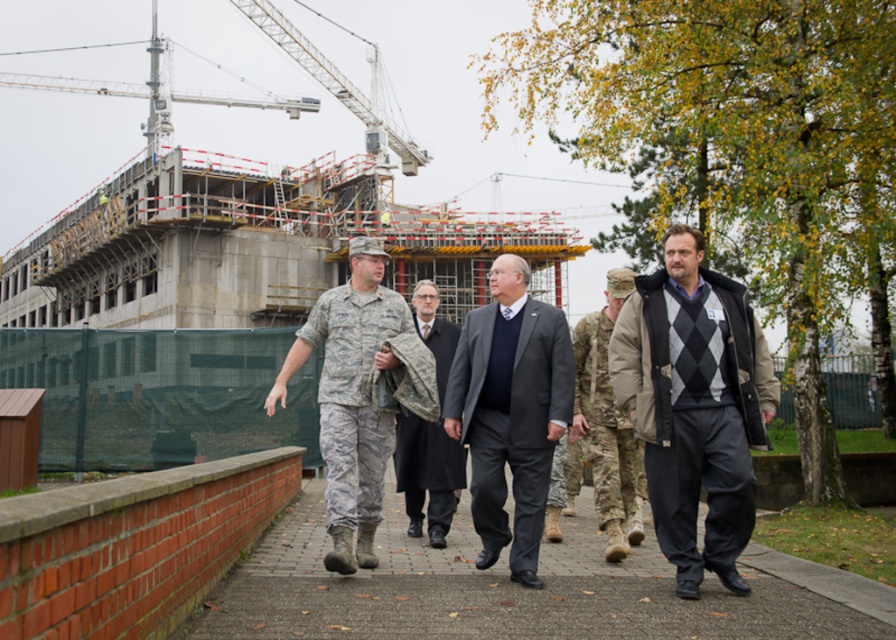
Question: Which object is positioned closest to the dark gray wool suit at center?

Choices:
 (A) camouflage uniform at center
 (B) gray concrete pavement at center
 (C) dark gray wool sweater at center

Answer: (A)

Question: Can you confirm if gray concrete pavement at center is positioned above camouflage uniform at center?

Choices:
 (A) no
 (B) yes

Answer: (A)

Question: Does gray concrete pavement at center have a greater width compared to dark gray wool suit at center?

Choices:
 (A) yes
 (B) no

Answer: (A)

Question: Which point is closer to the camera?

Choices:
 (A) camouflage uniform at center
 (B) dark gray wool sweater at center
 (C) camouflage fabric jacket at left
 (D) dark gray suit at center

Answer: (B)

Question: Which of these objects is positioned closest to the dark gray wool suit at center?

Choices:
 (A) camouflage uniform at center
 (B) dark gray suit at center
 (C) dark gray wool sweater at center

Answer: (A)

Question: Can you confirm if dark gray wool sweater at center is positioned to the right of dark gray wool suit at center?

Choices:
 (A) yes
 (B) no

Answer: (A)